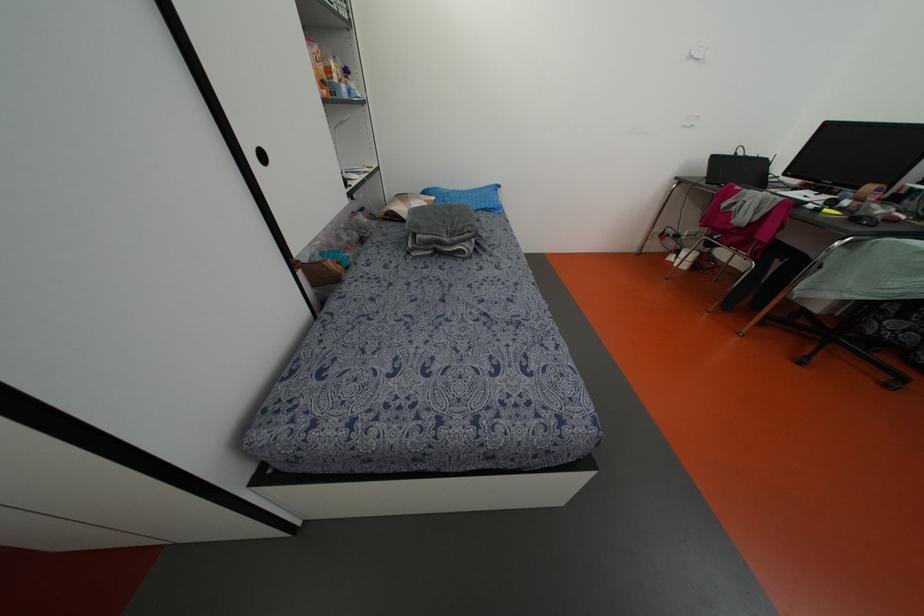
Where would you lift the patterned pillow? Please return your answer as a coordinate pair (x, y).

(399, 205)